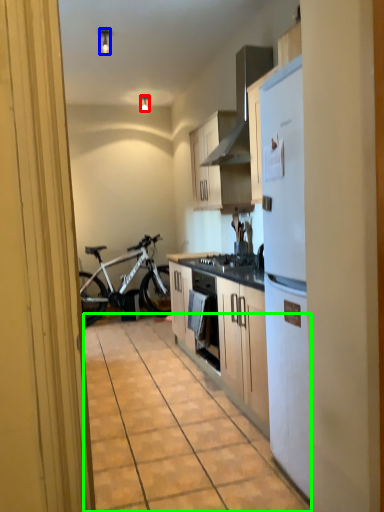
Question: Which object is the farthest from lamp (highlighted by a red box)? Choose among these: lamp (highlighted by a blue box) or alley (highlighted by a green box).

Choices:
 (A) lamp
 (B) alley

Answer: (B)